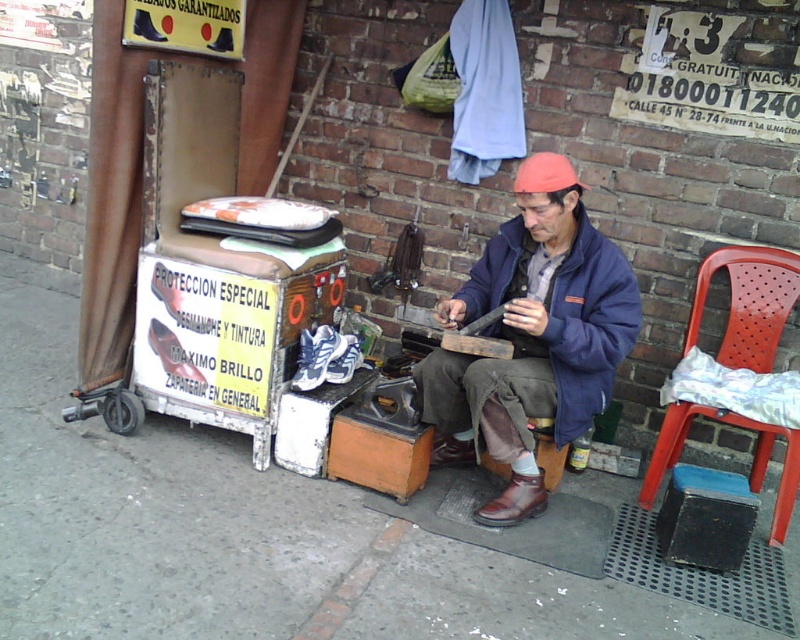
Is smooth concrete pavement at center taller than red plastic chair at right?

Correct, smooth concrete pavement at center is much taller as red plastic chair at right.

Between point (5, 579) and point (664, 420), which one is positioned in front?

Point (5, 579) is in front.

Is point (417, 552) positioned before point (758, 259)?

Yes, it is in front of point (758, 259).

This screenshot has width=800, height=640. I want to click on smooth concrete pavement at center, so click(241, 532).

Does shiny brown leather shoe at lower center have a lesser width compared to white leather shoe at center?

Incorrect, shiny brown leather shoe at lower center's width is not less than white leather shoe at center's.

Who is positioned more to the left, shiny brown leather shoe at lower center or white leather shoe at center?

Positioned to the left is white leather shoe at center.

Does point (524, 497) lie behind point (304, 337)?

No, it is not.

The height and width of the screenshot is (640, 800). Identify the location of shiny brown leather shoe at lower center. (514, 500).

Measure the distance between navy blue jacket at center and camera.

navy blue jacket at center is 2.12 meters away from camera.

Is navy blue jacket at center to the right of white leather shoe at center from the viewer's perspective?

Yes, navy blue jacket at center is to the right of white leather shoe at center.

Does point (560, 288) come closer to viewer compared to point (304, 362)?

Yes, point (560, 288) is closer to viewer.

At what (x,y) coordinates should I click in order to perform the action: click on navy blue jacket at center. Please return your answer as a coordinate pair (x, y). The image size is (800, 640). Looking at the image, I should click on pyautogui.click(x=590, y=324).